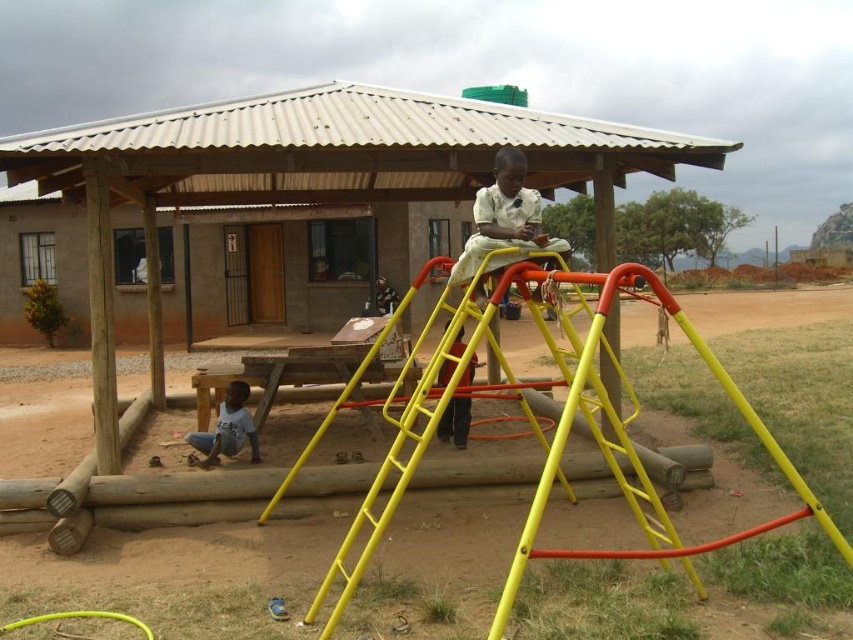
Question: Among these points, which one is farthest from the camera?

Choices:
 (A) (471, 257)
 (B) (228, 413)
 (C) (459, 337)

Answer: (B)

Question: Does white cotton shirt at center appear under light blue cotton shirt at lower left?

Choices:
 (A) yes
 (B) no

Answer: (B)

Question: In this image, where is yellow metal ladder at center located relative to light blue cotton shirt at lower left?

Choices:
 (A) right
 (B) left

Answer: (A)

Question: Which point is farther to the camera?

Choices:
 (A) (642, 285)
 (B) (503, 257)

Answer: (B)

Question: Which of the following is the farthest from the observer?

Choices:
 (A) (192, 444)
 (B) (344, 396)
 (C) (503, 189)

Answer: (A)

Question: Does yellow metal ladder at center have a lesser width compared to white cotton shirt at center?

Choices:
 (A) yes
 (B) no

Answer: (A)